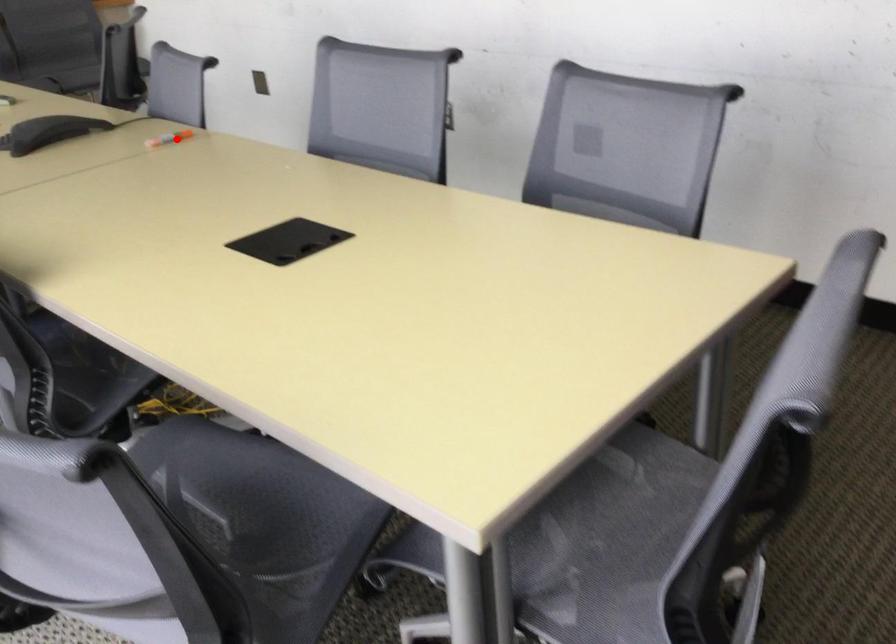
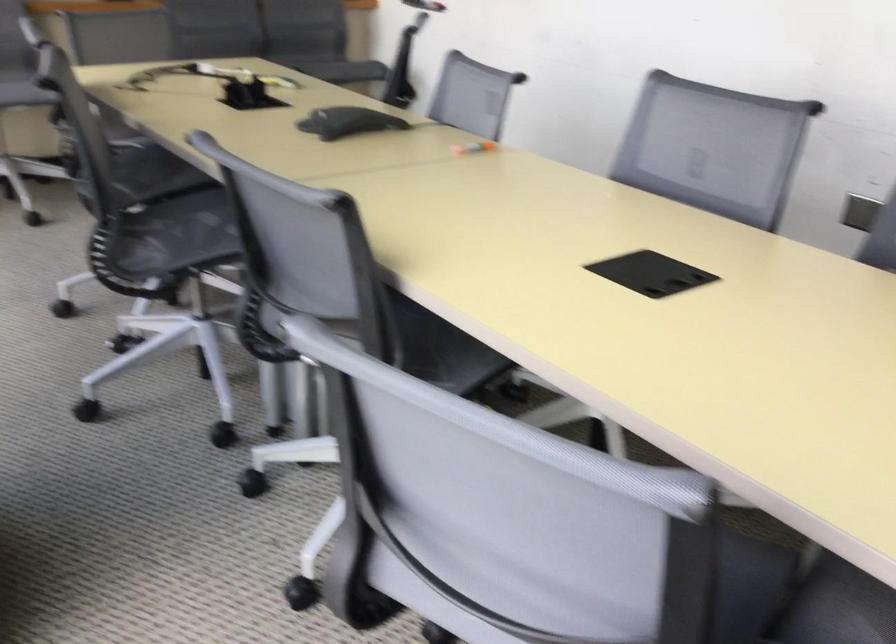
The point at the highlighted location is marked in the first image. Where is the corresponding point in the second image?

(474, 147)